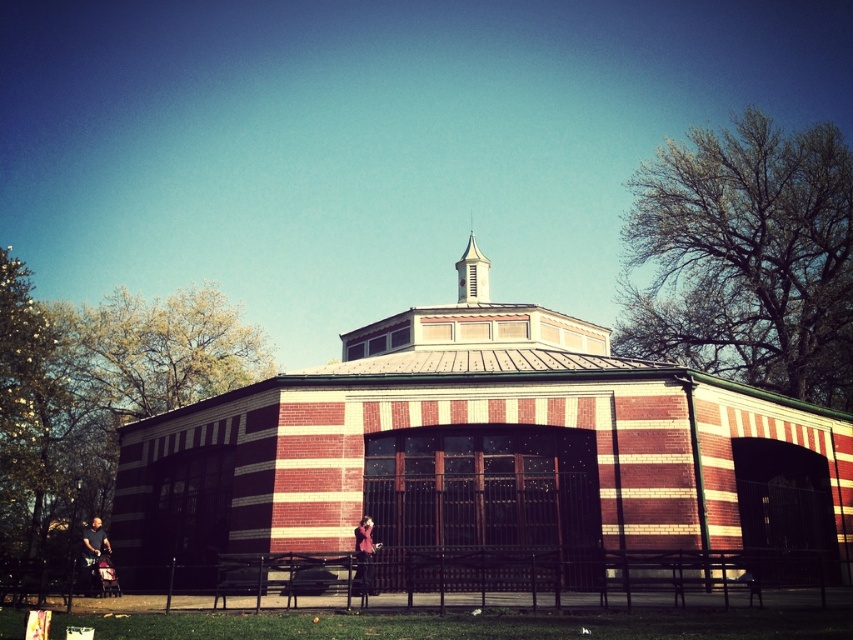
From the picture: You are standing in front of the red brick church at center and the black metal picnic table at center. Which object is closer to you?

The red brick church at center is closer to you because it is in front of the black metal picnic table at center.

You are planning to set up a picnic lunch at the black metal picnic table at center. To ensure sunlight reaches your meal, which direction should you position the picnic table relative to the white stucco spire at upper center?

Since the black metal picnic table at center is positioned to the left of the white stucco spire at upper center, you should orient the picnic table so that it faces away from the spire to maximize sunlight exposure, as the spire might cast a shadow if positioned directly behind it.